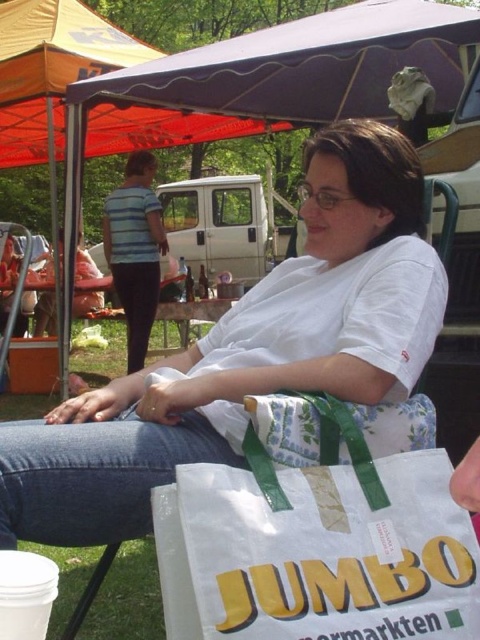
Can you confirm if white fabric bag at lower center is positioned to the right of striped shirt at upper left?

Yes, white fabric bag at lower center is to the right of striped shirt at upper left.

Is white fabric bag at lower center wider than striped shirt at upper left?

Incorrect, white fabric bag at lower center's width does not surpass striped shirt at upper left's.

Locate an element on the screen. The width and height of the screenshot is (480, 640). white fabric bag at lower center is located at coordinates (317, 544).

Is white cotton shirt at center shorter than striped shirt at upper left?

Yes, white cotton shirt at center is shorter than striped shirt at upper left.

Is point (312, 198) farther from camera compared to point (118, 227)?

No, it is in front of (118, 227).

The image size is (480, 640). What are the coordinates of `white cotton shirt at center` in the screenshot? It's located at (248, 353).

Is orange fabric canopy at upper center further to camera compared to striped shirt at upper left?

No, it is not.

Can you confirm if orange fabric canopy at upper center is wider than striped shirt at upper left?

Yes.

The width and height of the screenshot is (480, 640). Describe the element at coordinates (50, 70) in the screenshot. I see `orange fabric canopy at upper center` at that location.

At what (x,y) coordinates should I click in order to perform the action: click on orange fabric canopy at upper center. Please return your answer as a coordinate pair (x, y). Image resolution: width=480 pixels, height=640 pixels. Looking at the image, I should click on (50, 70).